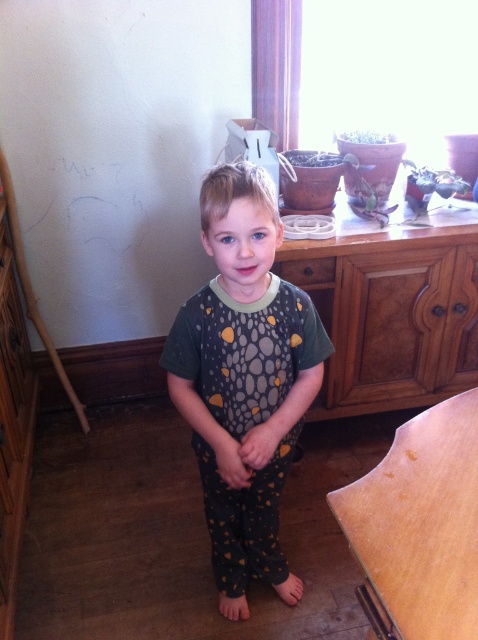
You are a parent trying to find your child a warm outfit for bedtime. You see the dark green jersey at center and the wooden at center. Which one should you choose?

The dark green jersey at center is the warm outfit, while the wooden at center is an inanimate object and not suitable for wearing.